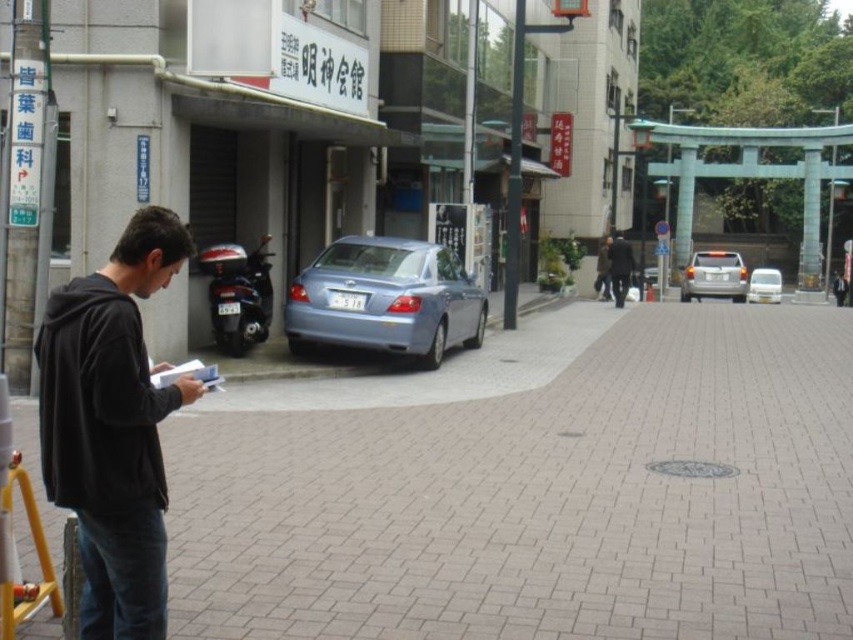
Question: Which point is closer to the camera taking this photo?

Choices:
 (A) (395, 376)
 (B) (357, 328)
 (C) (158, 513)

Answer: (C)

Question: Which point is closer to the camera?

Choices:
 (A) dark brown leather jacket at center
 (B) dark gray jacket at center
 (C) black matte sweatshirt at left
 (D) gray brick pavement at lower left

Answer: (C)

Question: Is black matte jacket at left closer to the viewer compared to satin blue sedan at center?

Choices:
 (A) no
 (B) yes

Answer: (B)

Question: Can you confirm if gray brick pavement at lower left is positioned to the left of satin blue sedan at center?

Choices:
 (A) no
 (B) yes

Answer: (A)

Question: Does gray brick pavement at lower left appear under dark gray jacket at center?

Choices:
 (A) yes
 (B) no

Answer: (A)

Question: Which of the following is the farthest from the observer?

Choices:
 (A) (38, 528)
 (B) (331, 600)

Answer: (B)